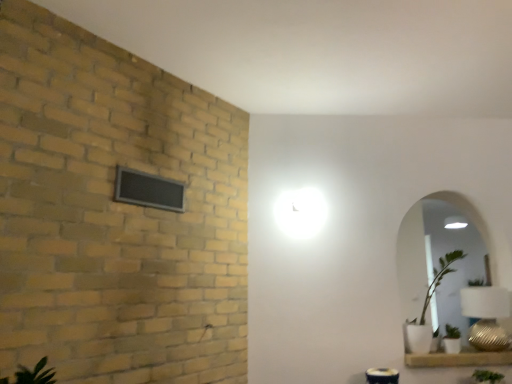
Question: Is white ceramic window sill at lower right wider or thinner than green leafy plant at lower right?

Choices:
 (A) thin
 (B) wide

Answer: (B)

Question: Is white ceramic window sill at lower right bigger or smaller than green leafy plant at lower right?

Choices:
 (A) big
 (B) small

Answer: (A)

Question: Which object is the farthest from the white ceramic window sill at lower right?

Choices:
 (A) black mesh window at upper left
 (B) green leafy plant at lower right
 (C) gold textured table lamp at lower right
 (D) white glossy mirror at right
 (E) metallic silver table at lower right

Answer: (A)

Question: Which object is the farthest from the gold textured table lamp at lower right?

Choices:
 (A) white ceramic window sill at lower right
 (B) white glossy mirror at right
 (C) black mesh window at upper left
 (D) green leafy plant at lower right
 (E) metallic silver table at lower right

Answer: (C)